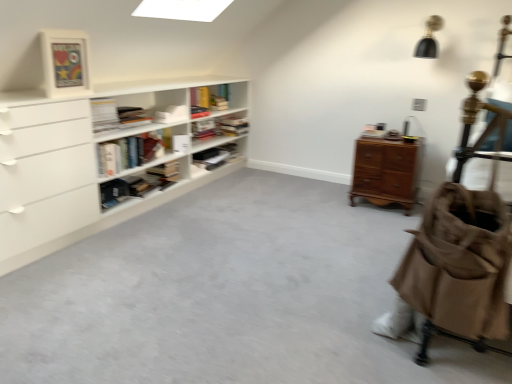
Question: Does matte black bookshelf at center, the second shelf when ordered from front to back, have a lesser height compared to light brown wooden chest of drawers at right?

Choices:
 (A) yes
 (B) no

Answer: (A)

Question: Is light brown wooden chest of drawers at right surrounded by matte black bookshelf at center, acting as the 2th shelf starting from the back?

Choices:
 (A) yes
 (B) no

Answer: (B)

Question: From the image's perspective, is matte black bookshelf at center, acting as the 2th shelf starting from the back, beneath light brown wooden chest of drawers at right?

Choices:
 (A) no
 (B) yes

Answer: (A)

Question: Considering the relative sizes of matte black bookshelf at center, acting as the 2th shelf starting from the back, and light brown wooden chest of drawers at right in the image provided, is matte black bookshelf at center, acting as the 2th shelf starting from the back, bigger than light brown wooden chest of drawers at right?

Choices:
 (A) yes
 (B) no

Answer: (B)

Question: Is matte black bookshelf at center, the second shelf when ordered from front to back, oriented away from light brown wooden chest of drawers at right?

Choices:
 (A) yes
 (B) no

Answer: (B)

Question: Considering the positions of light brown wooden chest of drawers at right and hardcover book at upper left, the third book positioned from the top, in the image, is light brown wooden chest of drawers at right taller or shorter than hardcover book at upper left, the third book positioned from the top,?

Choices:
 (A) short
 (B) tall

Answer: (B)

Question: From the image's perspective, is light brown wooden chest of drawers at right located above or below hardcover book at upper left, which is the 2th book from bottom to top?

Choices:
 (A) above
 (B) below

Answer: (B)

Question: Is light brown wooden chest of drawers at right in front of or behind hardcover book at upper left, which is the 2th book from bottom to top, in the image?

Choices:
 (A) front
 (B) behind

Answer: (B)

Question: Would you say light brown wooden chest of drawers at right is to the left or to the right of hardcover book at upper left, which is the 2th book from bottom to top, in the picture?

Choices:
 (A) right
 (B) left

Answer: (A)

Question: Looking at their shapes, would you say hardcover book at upper left, which is the 2th book from bottom to top, is wider or thinner than wooden bookshelf at upper center, placed as the 3th shelf when sorted from front to back?

Choices:
 (A) thin
 (B) wide

Answer: (A)

Question: From a real-world perspective, is hardcover book at upper left, which is the 2th book from bottom to top, positioned above or below wooden bookshelf at upper center, the 1th shelf when ordered from back to front?

Choices:
 (A) above
 (B) below

Answer: (A)

Question: From their relative heights in the image, would you say hardcover book at upper left, the third book positioned from the top, is taller or shorter than wooden bookshelf at upper center, placed as the 3th shelf when sorted from front to back?

Choices:
 (A) tall
 (B) short

Answer: (B)

Question: Is point (115, 120) positioned closer to the camera than point (214, 135)?

Choices:
 (A) farther
 (B) closer

Answer: (B)

Question: Does point (201, 114) appear closer or farther from the camera than point (150, 170)?

Choices:
 (A) closer
 (B) farther

Answer: (B)

Question: Considering the positions of white matte bookshelf at center, placed as the 4th book when sorted from bottom to top, and hardcover book at center, the 1th book when ordered from bottom to top, in the image, is white matte bookshelf at center, placed as the 4th book when sorted from bottom to top, wider or thinner than hardcover book at center, the 1th book when ordered from bottom to top,?

Choices:
 (A) wide
 (B) thin

Answer: (B)